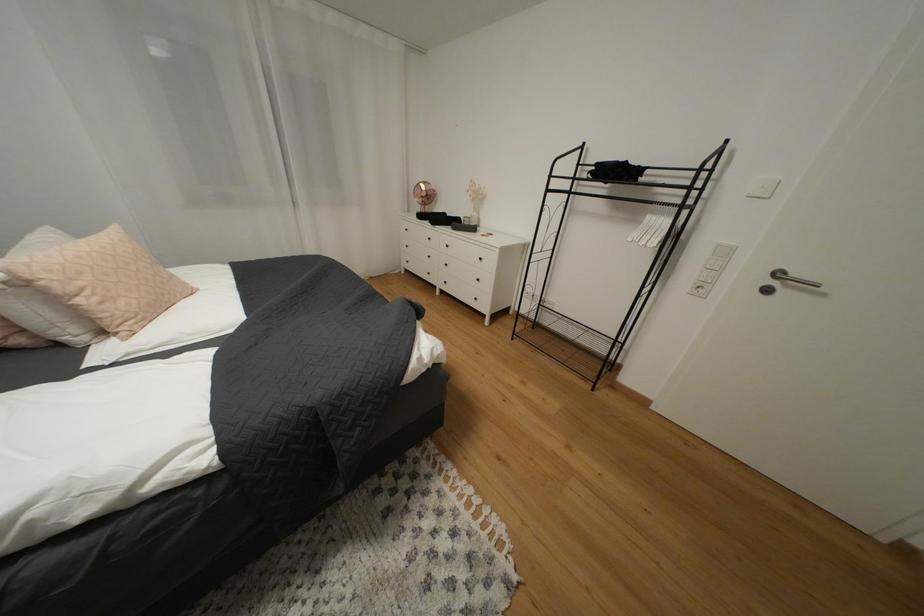
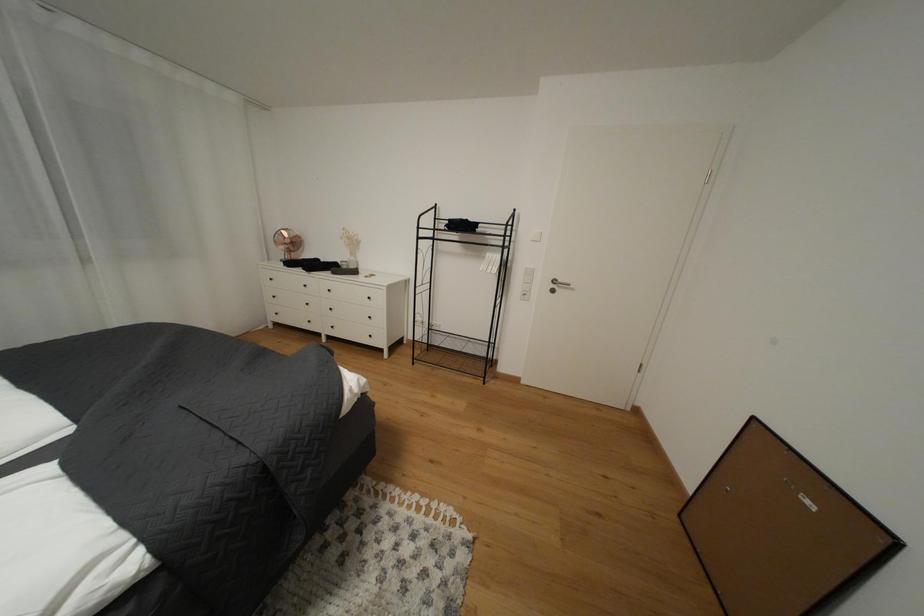
Question: The first image is from the beginning of the video and the second image is from the end. How did the camera likely rotate when shooting the video?

Choices:
 (A) Left
 (B) Right
 (C) Up
 (D) Down

Answer: (B)